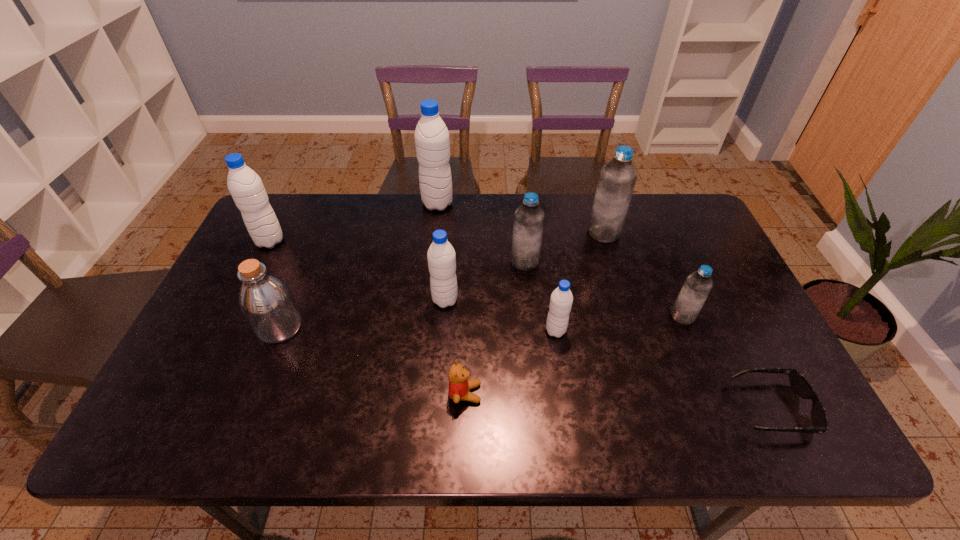
You are a GUI agent. You are given a task and a screenshot of the screen. Output one action in this format:
    pyautogui.click(x=<x>, y=<y>)
    Task: Click on the tallest object
    Image resolution: width=960 pixels, height=540 pixels.
    Given the screenshot: What is the action you would take?
    pyautogui.click(x=432, y=142)

Identify the location of the tallest water bottle. (432, 142).

Identify the location of the second water bottle from right to left. This screenshot has width=960, height=540. (617, 180).

What are the coordinates of `the second blue water bottle from left to right` in the screenshot? It's located at (617, 180).

At what (x,y) coordinates should I click in order to perform the action: click on the third smallest gray water bottle. Please return your answer as a coordinate pair (x, y). Looking at the image, I should click on (245, 186).

You are a GUI agent. You are given a task and a screenshot of the screen. Output one action in this format:
    pyautogui.click(x=<x>, y=<y>)
    Task: Click on the third nearest gray water bottle
    
    Given the screenshot: What is the action you would take?
    pyautogui.click(x=245, y=186)

This screenshot has width=960, height=540. Identify the location of the second smallest blue water bottle. (529, 217).

This screenshot has height=540, width=960. I want to click on the leftmost blue water bottle, so click(529, 217).

Identify the location of the third biggest gray water bottle. This screenshot has width=960, height=540. (441, 256).

I want to click on the ninth object from right to left, so click(267, 303).